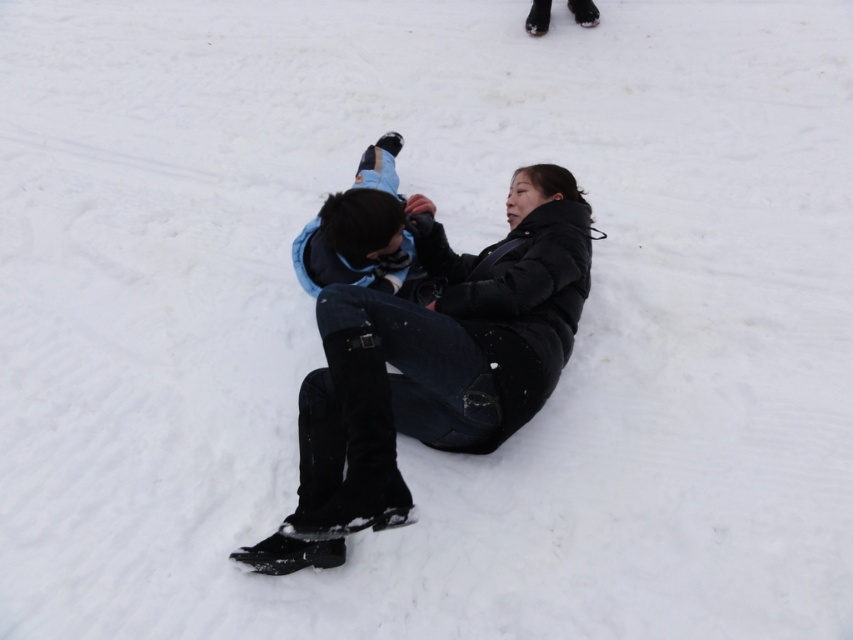
Can you confirm if black matte jacket at center is taller than light blue denim snowboard at center?

Correct, black matte jacket at center is much taller as light blue denim snowboard at center.

Who is lower down, black matte jacket at center or light blue denim snowboard at center?

black matte jacket at center is lower down.

Measure the distance between point (473, 397) and camera.

Point (473, 397) is 9.13 feet away from camera.

The width and height of the screenshot is (853, 640). I want to click on black matte jacket at center, so click(433, 364).